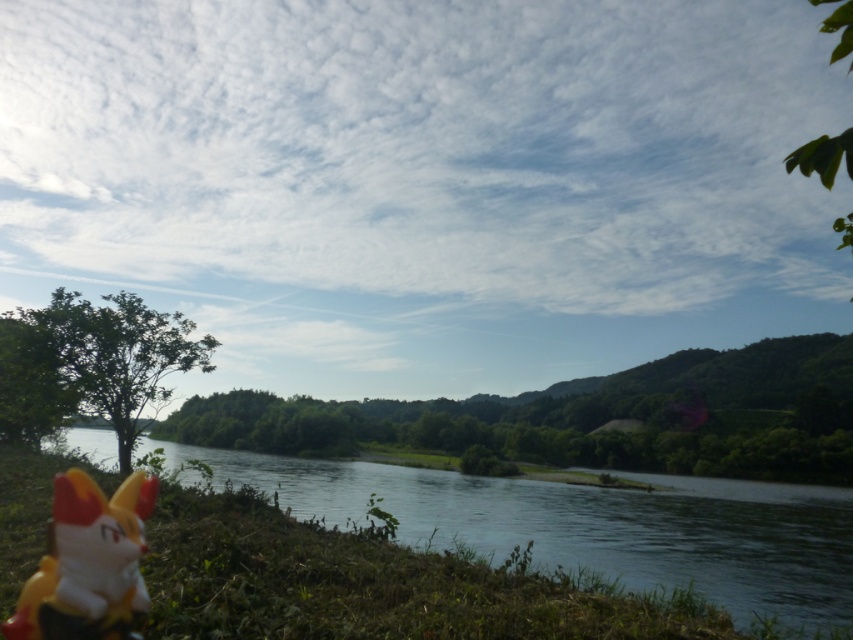
Is the position of clear water at river left less distant than that of yellow plastic toy at lower left?

No, clear water at river left is further to the viewer.

Is clear water at river left to the left of yellow plastic toy at lower left from the viewer's perspective?

In fact, clear water at river left is to the right of yellow plastic toy at lower left.

The image size is (853, 640). Find the location of `clear water at river left`. clear water at river left is located at coordinates (593, 525).